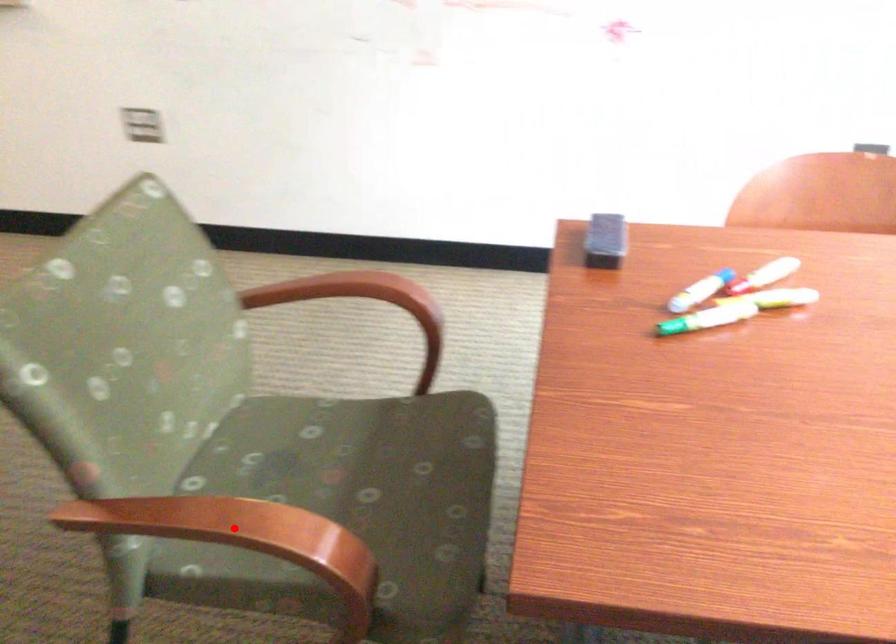
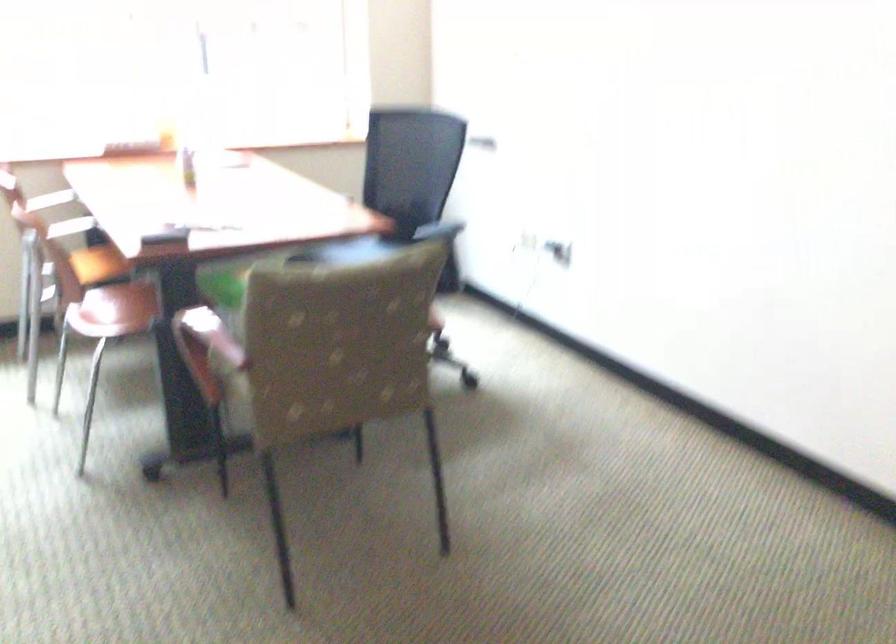
Question: I am providing you with two images of the same scene from different viewpoints. A red point is marked on the first image. Can you still see the location of the red point in image 2?

Choices:
 (A) Yes
 (B) No

Answer: (B)